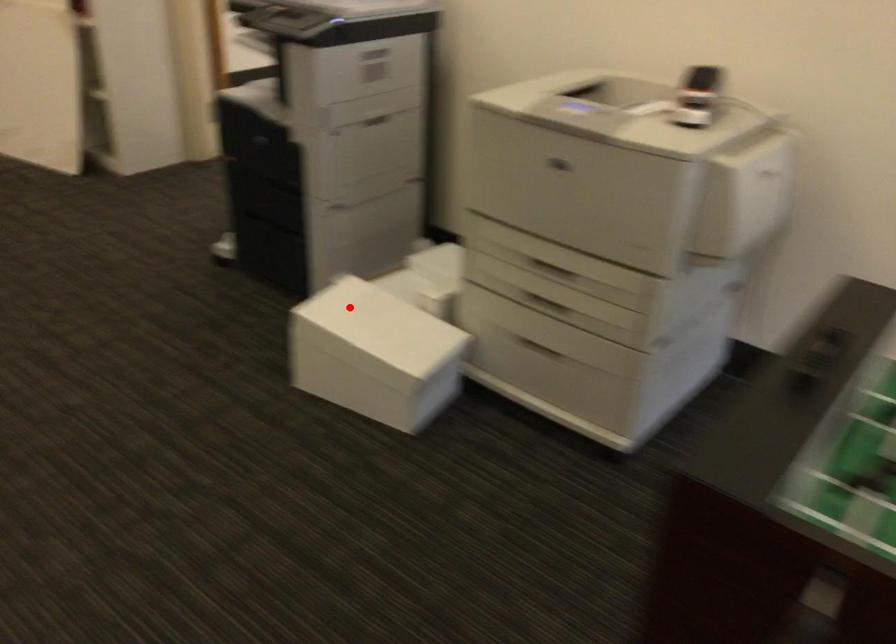
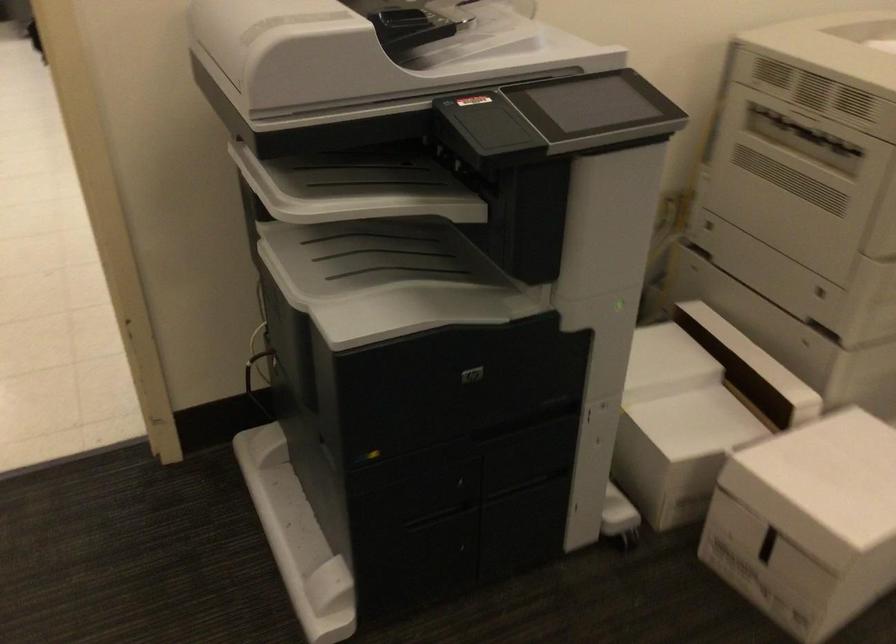
Question: I am providing you with two images of the same scene from different viewpoints. Given a red point in image1, look at the same physical point in image2. Is it:

Choices:
 (A) Closer to the viewpoint
 (B) Farther from the viewpoint

Answer: (A)